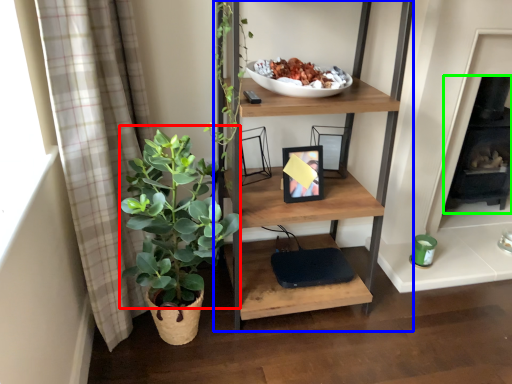
Question: Based on their relative distances, which object is nearer to vegetation (highlighted by a red box)? Choose from shelf (highlighted by a blue box) and fireplace (highlighted by a green box).

Choices:
 (A) shelf
 (B) fireplace

Answer: (A)